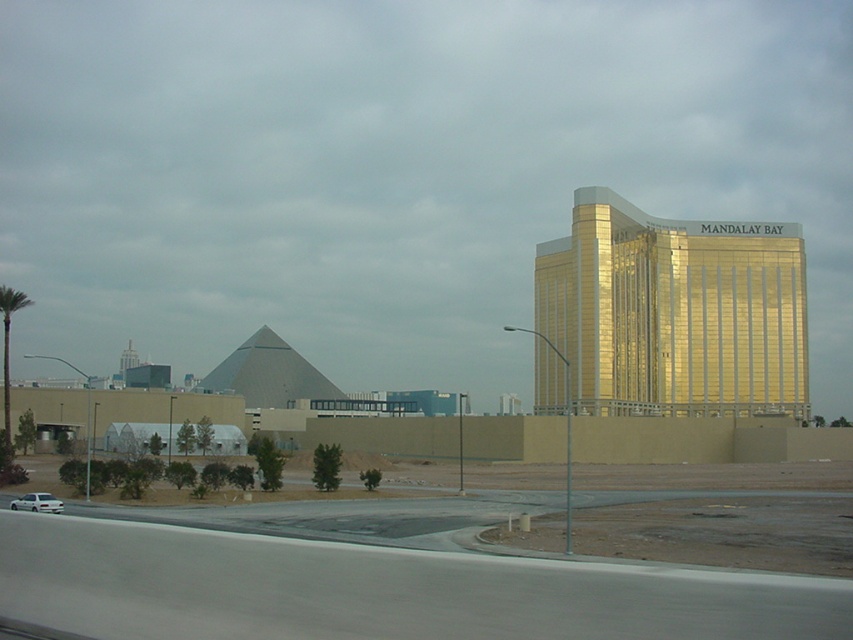
You are standing on the road in front of the gold reflective building at right and the green leafy palm tree at left. If you want to walk to the narrower structure, which one should you head towards?

The gold reflective building at right has a lesser width compared to the green leafy palm tree at left, so you should head towards the gold reflective building at right since it is narrower.

From the picture: You are a tourist standing on the sidewalk in front of the Mandalay Bay hotel and casino. You see the green leafy palm tree at left and the white matte car at lower left. Which object is bigger?

The green leafy palm tree at left is larger in size than the white matte car at lower left.

You are standing on the sidewalk near the Mandalay Bay hotel and casino. You see a green leafy palm tree at left and a white matte car at lower left. Which object is higher from the ground?

The green leafy palm tree at left is above the white matte car at lower left, so the palm tree is higher from the ground.